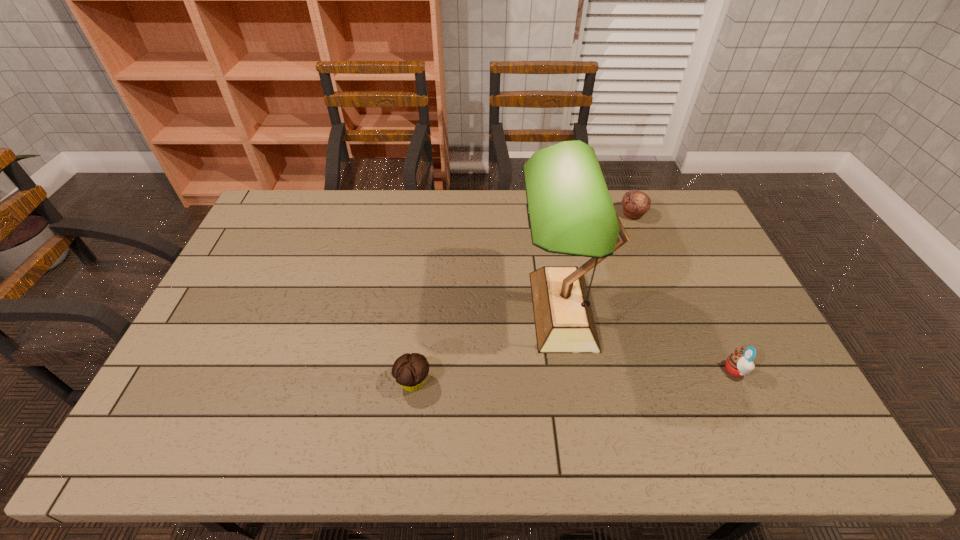
You are a GUI agent. You are given a task and a screenshot of the screen. Output one action in this format:
    pyautogui.click(x=<x>, y=<y>)
    Task: Click on the vacant region located 0.250m on the front-facing side of the rightmost object
    The height and width of the screenshot is (540, 960).
    Given the screenshot: What is the action you would take?
    pyautogui.click(x=629, y=370)

You are a GUI agent. You are given a task and a screenshot of the screen. Output one action in this format:
    pyautogui.click(x=<x>, y=<y>)
    Task: Click on the free region located on the front-facing side of the rightmost object
    The width and height of the screenshot is (960, 540).
    Given the screenshot: What is the action you would take?
    pyautogui.click(x=625, y=370)

Locate an element on the screen. vacant space located on the front-facing side of the rightmost object is located at coordinates (588, 370).

Find the location of `vacant space located 0.380m on the back of the leftmost muffin`. vacant space located 0.380m on the back of the leftmost muffin is located at coordinates (427, 266).

I want to click on object that is positioned at the far edge, so click(635, 203).

This screenshot has height=540, width=960. Identify the location of object present at the right edge. (738, 364).

Image resolution: width=960 pixels, height=540 pixels. In the image, there is a desktop. In order to click on vacant space at the far edge in this screenshot , I will do `click(432, 230)`.

Where is `free space at the near edge of the desktop`? free space at the near edge of the desktop is located at coordinates (708, 448).

At what (x,y) coordinates should I click in order to perform the action: click on vacant space at the right edge of the desktop. Please return your answer as a coordinate pair (x, y). Looking at the image, I should click on (669, 247).

In the image, there is a desktop. At what (x,y) coordinates should I click in order to perform the action: click on vacant space at the far right corner. Please return your answer as a coordinate pair (x, y). This screenshot has height=540, width=960. Looking at the image, I should click on (684, 198).